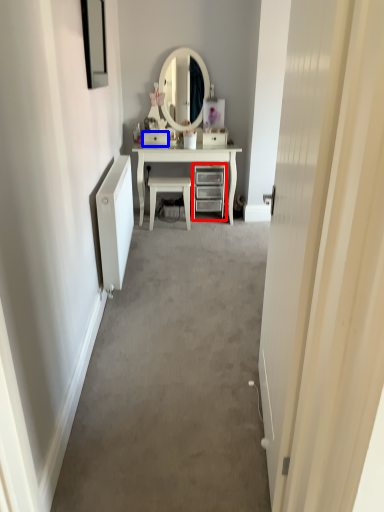
Question: Which point is closer to the camera, chest of drawers (highlighted by a red box) or drawer (highlighted by a blue box)?

Choices:
 (A) chest of drawers
 (B) drawer

Answer: (A)